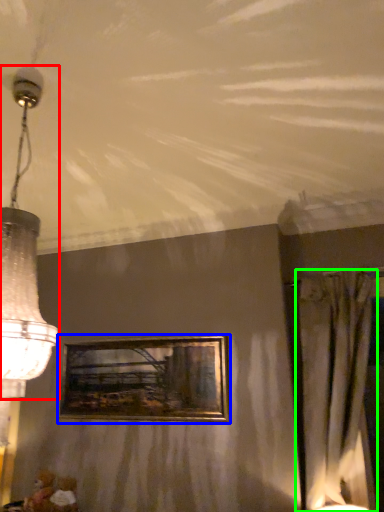
Question: Estimate the real-world distances between objects in this image. Which object is closer to lamp (highlighted by a red box), picture frame (highlighted by a blue box) or curtain (highlighted by a green box)?

Choices:
 (A) picture frame
 (B) curtain

Answer: (A)